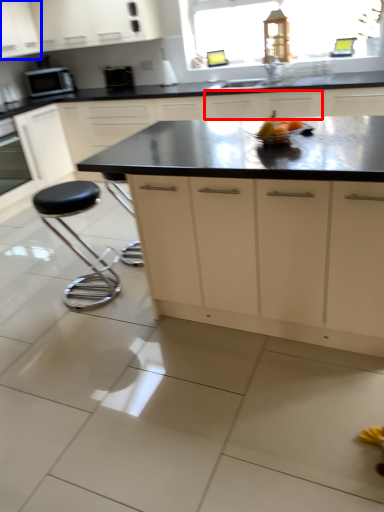
Question: Among these objects, which one is nearest to the camera, cabinetry (highlighted by a red box) or cabinetry (highlighted by a blue box)?

Choices:
 (A) cabinetry
 (B) cabinetry

Answer: (A)